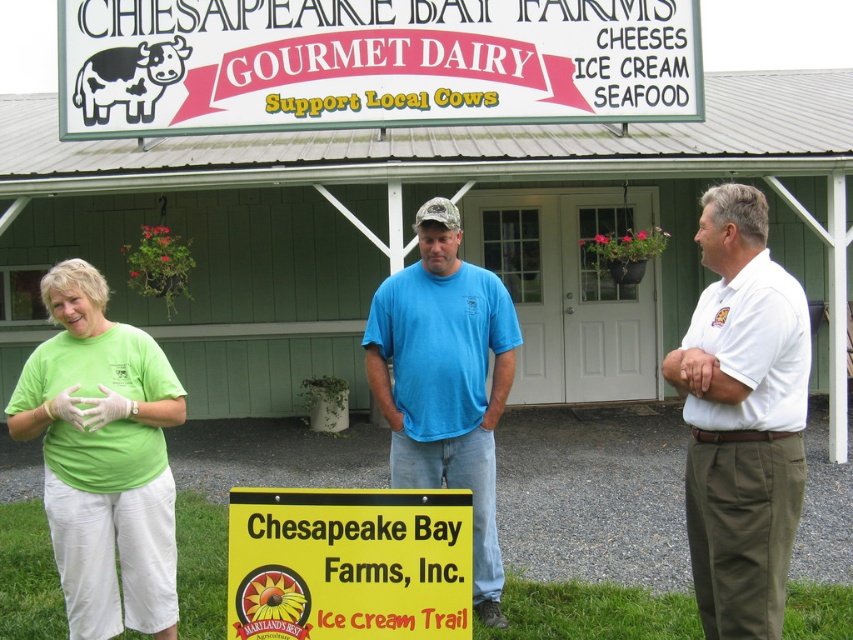
Question: Where is white cotton shirt at center located in relation to blue cotton t-shirt at center in the image?

Choices:
 (A) below
 (B) above

Answer: (B)

Question: Among these objects, which one is farthest from the camera?

Choices:
 (A) green matte t-shirt at center
 (B) yellow plastic sign at center

Answer: (A)

Question: Does green t-shirt at left have a lesser width compared to yellow plastic sign at center?

Choices:
 (A) no
 (B) yes

Answer: (B)

Question: Estimate the real-world distances between objects in this image. Which object is closer to the blue cotton t-shirt at center?

Choices:
 (A) green matte t-shirt at center
 (B) yellow plastic sign at center
 (C) white cotton shirt at center

Answer: (B)

Question: Which object is positioned closest to the yellow plastic sign at center?

Choices:
 (A) green matte t-shirt at center
 (B) white plastic sign at upper center
 (C) green t-shirt at left
 (D) white cotton shirt at center

Answer: (A)

Question: Is white plastic sign at upper center thinner than white cotton shirt at center?

Choices:
 (A) yes
 (B) no

Answer: (B)